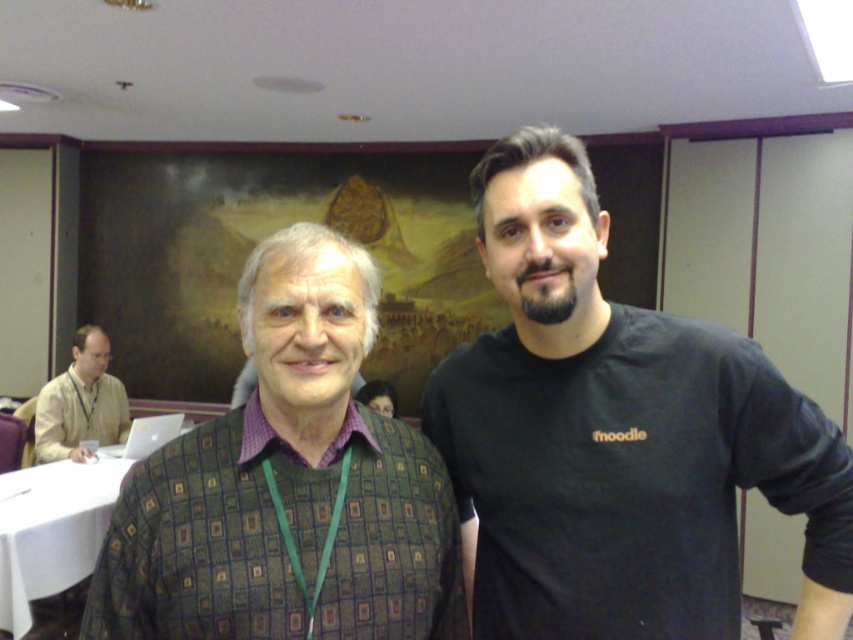
You are a photographer setting up for a group photo in the conference room. You need to position the two people so that the person wearing the green textured sweater at center is on your left side and the one in the black matte shirt at center is on your right side. Based on their current positions, do they need to switch places?

The black matte shirt at center is currently to the right of the green textured sweater at center, so they are already positioned correctly with the green textured sweater at center on the left and the black matte shirt at center on the right. No switch is needed.